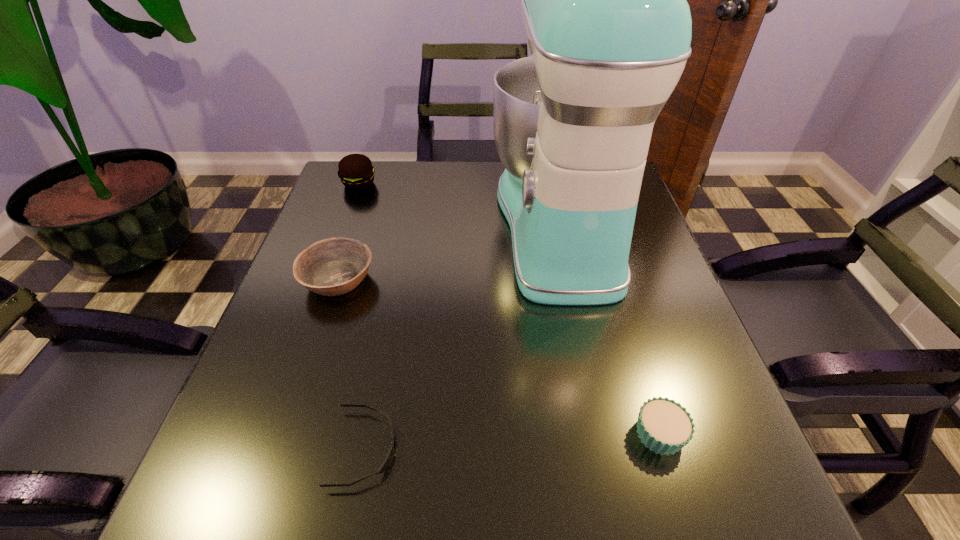
Identify the location of object that is at the far right corner. (604, 4).

The height and width of the screenshot is (540, 960). Find the location of `blank space at the far edge of the desktop`. blank space at the far edge of the desktop is located at coordinates (484, 176).

You are a GUI agent. You are given a task and a screenshot of the screen. Output one action in this format:
    pyautogui.click(x=<x>, y=<y>)
    Task: Click on the blank space at the near edge
    The width and height of the screenshot is (960, 540).
    Given the screenshot: What is the action you would take?
    pyautogui.click(x=588, y=533)

The image size is (960, 540). Find the location of `vacant region at the left edge of the desktop`. vacant region at the left edge of the desktop is located at coordinates click(x=247, y=420).

This screenshot has height=540, width=960. I want to click on vacant region at the right edge, so click(689, 329).

Image resolution: width=960 pixels, height=540 pixels. I want to click on free spot at the far left corner of the desktop, so click(381, 160).

Where is `empty space between the fourth tallest object and the shortest object`? The height and width of the screenshot is (540, 960). empty space between the fourth tallest object and the shortest object is located at coordinates [x=512, y=441].

Locate an element on the screen. The image size is (960, 540). empty location between the third tallest object and the second tallest object is located at coordinates (348, 232).

Where is `vacant area that lies between the mixer and the fourth tallest object`? The image size is (960, 540). vacant area that lies between the mixer and the fourth tallest object is located at coordinates (610, 329).

At what (x,y) coordinates should I click in order to perform the action: click on empty location between the fourth tallest object and the sunglasses. Please return your answer as a coordinate pair (x, y). The width and height of the screenshot is (960, 540). Looking at the image, I should click on (512, 441).